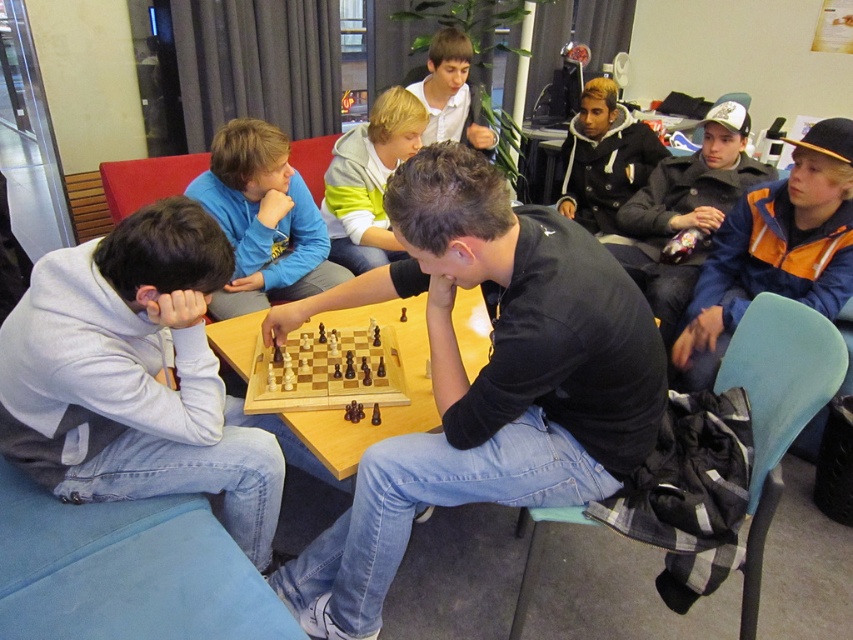
Question: Among these objects, which one is farthest from the camera?

Choices:
 (A) wooden chessboard at center
 (B) orange and blue jacket at right

Answer: (B)

Question: Can you confirm if orange and blue jacket at right is positioned above light gray hoodie at center?

Choices:
 (A) yes
 (B) no

Answer: (B)

Question: Which of these objects is positioned closest to the gray fleece hoodie at left?

Choices:
 (A) blue fleece jacket at upper left
 (B) white shirt at upper center

Answer: (A)

Question: Is orange and blue jacket at right thinner than white shirt at upper center?

Choices:
 (A) no
 (B) yes

Answer: (A)

Question: Does blue fleece jacket at upper left appear under light gray hoodie at center?

Choices:
 (A) no
 (B) yes

Answer: (B)

Question: Among these points, which one is farthest from the camera?

Choices:
 (A) (358, 332)
 (B) (440, 92)
 (C) (844, 292)
 (D) (416, 131)

Answer: (B)